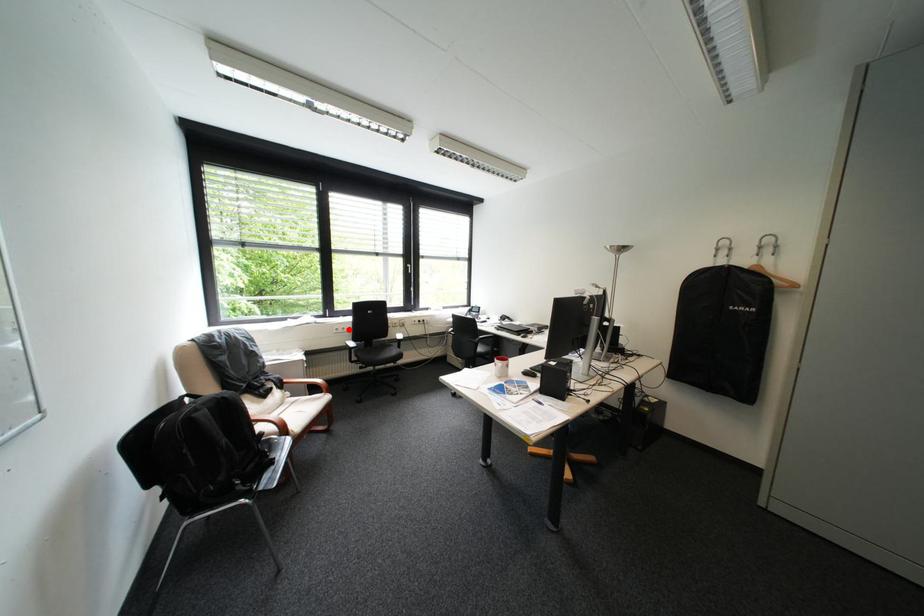
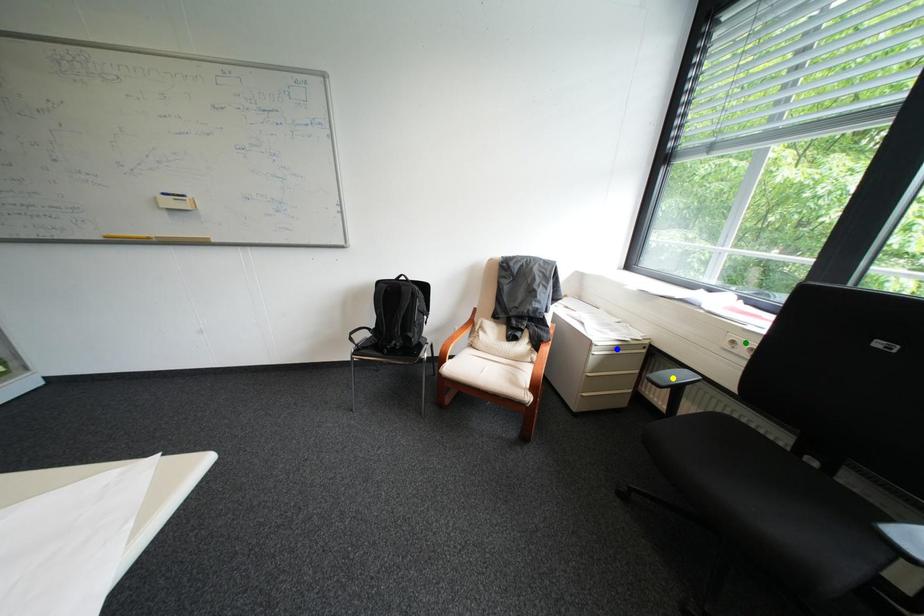
Question: I am providing you with two images of the same scene from different viewpoints. A red point is marked on the first image. You are given multiple points on the second image. In image 2, which mark is for the same physical point as the one in image 1?

Choices:
 (A) green point
 (B) blue point
 (C) yellow point

Answer: (A)